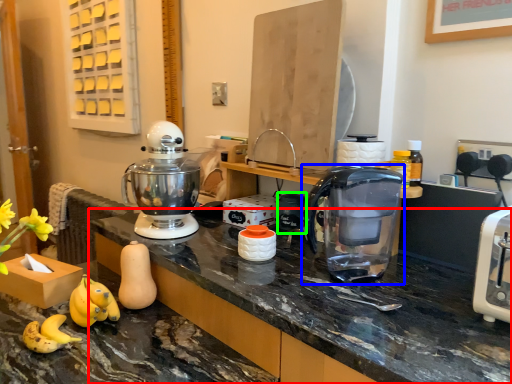
Question: Which is nearer to the countertop (highlighted by a red box)? coffeepot (highlighted by a blue box) or appliance (highlighted by a green box).

Choices:
 (A) coffeepot
 (B) appliance

Answer: (A)